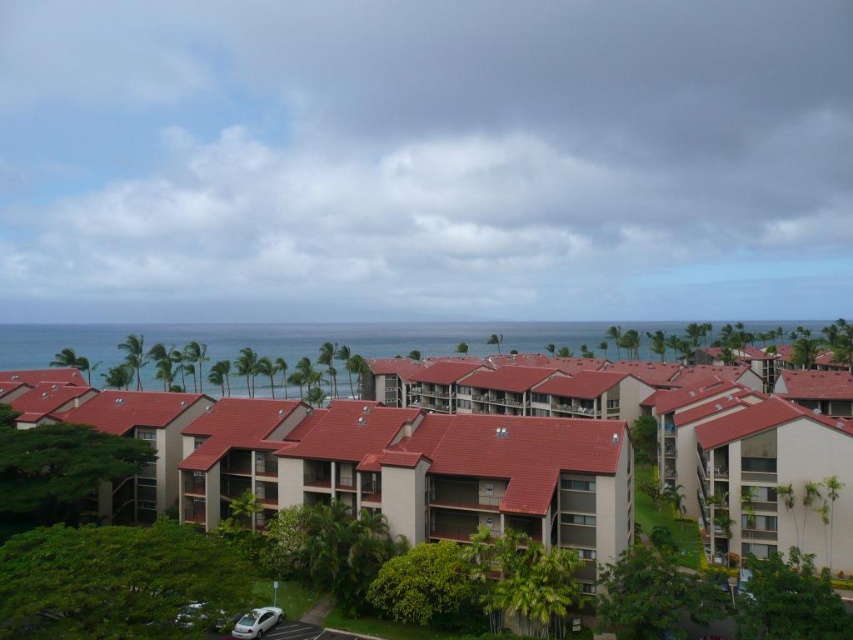
Measure the distance from brown textured building at center to white matte car at lower center.

They are 152.03 feet apart.

Which is in front, point (479, 416) or point (202, 604)?

Positioned in front is point (202, 604).

Find the location of a particular element. This screenshot has width=853, height=640. brown textured building at center is located at coordinates (498, 456).

Does brown textured building at center appear on the right side of white matte car at lower left?

Correct, you'll find brown textured building at center to the right of white matte car at lower left.

Is brown textured building at center taller than white matte car at lower left?

Correct, brown textured building at center is much taller as white matte car at lower left.

Is point (198, 516) more distant than point (242, 637)?

Yes.

This screenshot has width=853, height=640. I want to click on brown textured building at center, so click(498, 456).

Does white matte car at lower left lie in front of white matte car at lower center?

No, it is not.

Which is more to the right, white matte car at lower left or white matte car at lower center?

white matte car at lower left

Is point (259, 627) closer to camera compared to point (201, 612)?

No, it is behind (201, 612).

The width and height of the screenshot is (853, 640). In order to click on white matte car at lower left in this screenshot , I will do `click(256, 621)`.